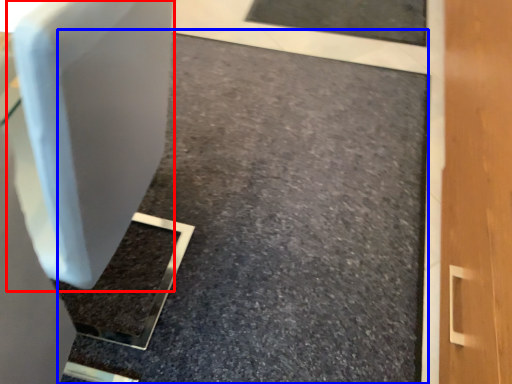
Question: Which point is further to the camera, swivel chair (highlighted by a red box) or concrete (highlighted by a blue box)?

Choices:
 (A) swivel chair
 (B) concrete

Answer: (B)